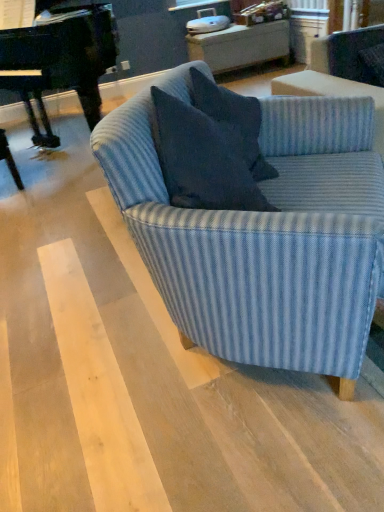
Question: Does black polished piano at left appear on the left side of dark blue fabric pillow at center?

Choices:
 (A) no
 (B) yes

Answer: (B)

Question: Is black polished piano at left further to the viewer compared to dark blue fabric pillow at center?

Choices:
 (A) yes
 (B) no

Answer: (A)

Question: Is black polished piano at left smaller than dark blue fabric pillow at center?

Choices:
 (A) no
 (B) yes

Answer: (A)

Question: Is black polished piano at left aimed at dark blue fabric pillow at center?

Choices:
 (A) yes
 (B) no

Answer: (B)

Question: Considering the relative sizes of black polished piano at left and dark blue fabric pillow at center in the image provided, is black polished piano at left shorter than dark blue fabric pillow at center?

Choices:
 (A) no
 (B) yes

Answer: (A)

Question: Considering the relative positions of black polished piano at left and dark blue fabric pillow at center in the image provided, is black polished piano at left to the right of dark blue fabric pillow at center from the viewer's perspective?

Choices:
 (A) yes
 (B) no

Answer: (B)

Question: From a real-world perspective, is blue striped fabric swivel chair at upper right physically above black polished piano at left?

Choices:
 (A) no
 (B) yes

Answer: (A)

Question: Is blue striped fabric swivel chair at upper right far away from black polished piano at left?

Choices:
 (A) no
 (B) yes

Answer: (B)

Question: Does blue striped fabric swivel chair at upper right have a smaller size compared to black polished piano at left?

Choices:
 (A) yes
 (B) no

Answer: (A)

Question: Is the depth of blue striped fabric swivel chair at upper right greater than that of black polished piano at left?

Choices:
 (A) yes
 (B) no

Answer: (B)

Question: Can you confirm if blue striped fabric swivel chair at upper right is wider than black polished piano at left?

Choices:
 (A) yes
 (B) no

Answer: (B)

Question: Can we say blue striped fabric swivel chair at upper right lies outside black polished piano at left?

Choices:
 (A) yes
 (B) no

Answer: (A)

Question: Is the depth of blue striped fabric couch at center less than that of dark blue fabric pillow at center?

Choices:
 (A) no
 (B) yes

Answer: (B)